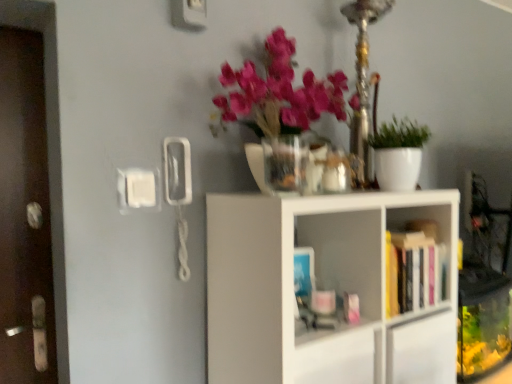
Question: Is brown wooden door at left completely or partially outside of white matte plant pot at right?

Choices:
 (A) no
 (B) yes

Answer: (B)

Question: Is brown wooden door at left placed right next to white matte plant pot at right?

Choices:
 (A) yes
 (B) no

Answer: (B)

Question: From the image's perspective, is brown wooden door at left under white matte plant pot at right?

Choices:
 (A) yes
 (B) no

Answer: (A)

Question: Is brown wooden door at left far away from white matte plant pot at right?

Choices:
 (A) yes
 (B) no

Answer: (A)

Question: Could you tell me if brown wooden door at left is turned towards white matte plant pot at right?

Choices:
 (A) no
 (B) yes

Answer: (A)

Question: Is brown wooden door at left looking in the opposite direction of white matte plant pot at right?

Choices:
 (A) no
 (B) yes

Answer: (A)

Question: Can you confirm if hardcover books at center right, positioned as the second shelf in bottom-to-top order, is bigger than translucent glass vase at upper center?

Choices:
 (A) yes
 (B) no

Answer: (A)

Question: Is hardcover books at center right, positioned as the second shelf in bottom-to-top order, next to translucent glass vase at upper center?

Choices:
 (A) no
 (B) yes

Answer: (A)

Question: From the image's perspective, is hardcover books at center right, positioned as the second shelf in bottom-to-top order, located above translucent glass vase at upper center?

Choices:
 (A) yes
 (B) no

Answer: (B)

Question: Is the position of hardcover books at center right, positioned as the second shelf in bottom-to-top order, more distant than that of translucent glass vase at upper center?

Choices:
 (A) no
 (B) yes

Answer: (B)

Question: From a real-world perspective, is hardcover books at center right, positioned as the second shelf in bottom-to-top order, beneath translucent glass vase at upper center?

Choices:
 (A) yes
 (B) no

Answer: (A)

Question: Can you confirm if hardcover books at center right, positioned as the second shelf in bottom-to-top order, is positioned to the left of translucent glass vase at upper center?

Choices:
 (A) no
 (B) yes

Answer: (A)

Question: From a real-world perspective, is translucent glass vase at upper center below white matte shelf at center, which is the first shelf from bottom to top?

Choices:
 (A) no
 (B) yes

Answer: (A)